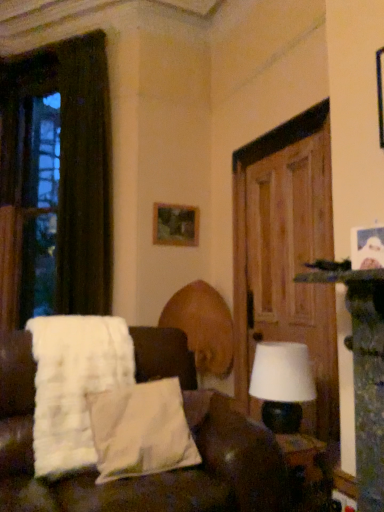
Question: From a real-world perspective, is wooden picture frame at upper center physically located above or below white soft pillow at lower left?

Choices:
 (A) below
 (B) above

Answer: (B)

Question: Looking at the image, does wooden picture frame at upper center seem bigger or smaller compared to white soft pillow at lower left?

Choices:
 (A) big
 (B) small

Answer: (B)

Question: Which object is the closest to the transparent glass window at left?

Choices:
 (A) white fabric couch at center
 (B) wooden picture frame at upper center
 (C) white soft pillow at lower left
 (D) dark brown fabric curtain at left
 (E) white matte table lamp at right

Answer: (D)

Question: Based on their relative distances, which object is nearer to the white fluffy blanket at left?

Choices:
 (A) dark brown fabric curtain at left
 (B) wooden door at right
 (C) white fabric couch at center
 (D) white matte table lamp at right
 (E) wooden picture frame at upper center

Answer: (C)